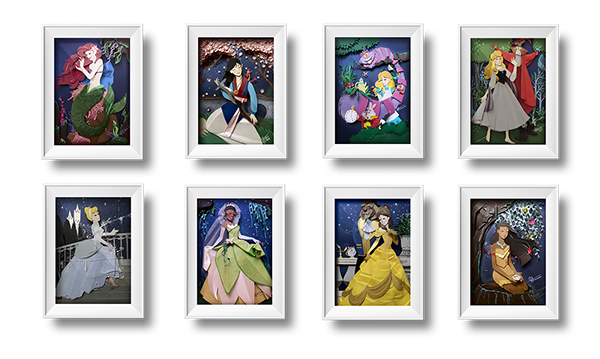
Where is `frame`? Image resolution: width=600 pixels, height=359 pixels. frame is located at coordinates (211, 105).